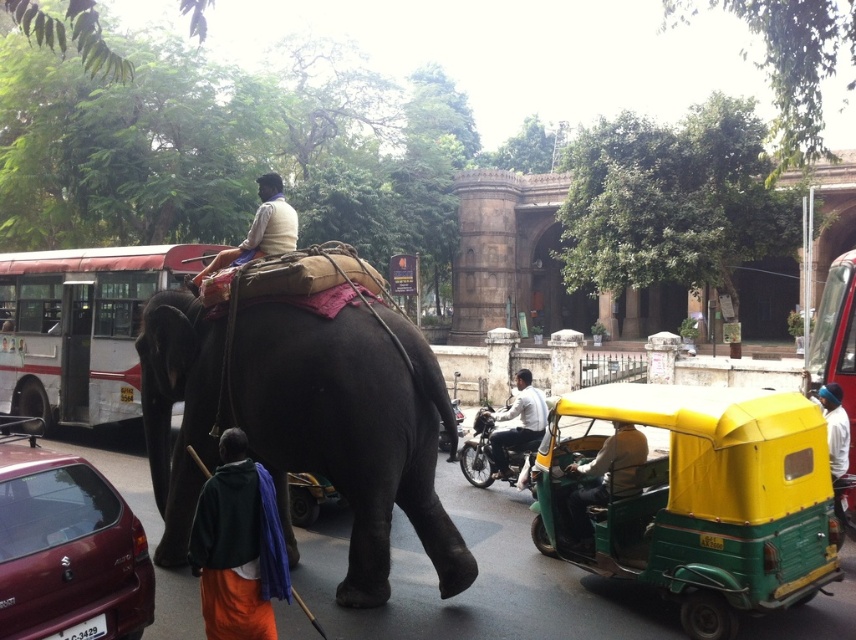
Question: Based on their relative distances, which object is nearer to the dark gray elephant at center?

Choices:
 (A) green plastic rickshaw at center
 (B) orange cotton dhoti at lower left
 (C) light brown leather jacket at center

Answer: (B)

Question: Which of the following is the closest to the observer?

Choices:
 (A) orange cotton dhoti at lower left
 (B) white painted bus at center

Answer: (A)

Question: Can you confirm if dark gray elephant at center is thinner than orange cotton dhoti at lower left?

Choices:
 (A) no
 (B) yes

Answer: (A)

Question: Among these points, which one is nearest to the camera?

Choices:
 (A) (684, 608)
 (B) (842, 349)
 (C) (24, 620)
 (D) (217, 516)

Answer: (C)

Question: Does dark gray elephant at center have a greater width compared to metallic red bus at right?

Choices:
 (A) yes
 (B) no

Answer: (A)

Question: Can you confirm if maroon matte car at lower left is positioned to the left of light beige fabric at center?

Choices:
 (A) yes
 (B) no

Answer: (B)